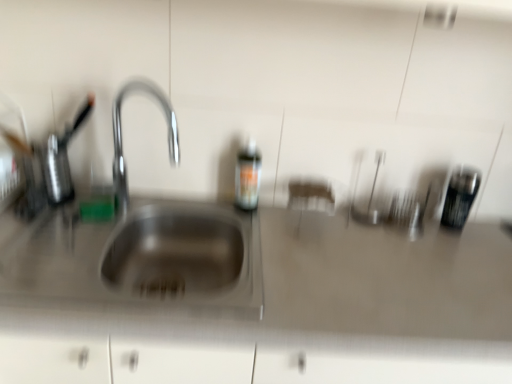
Question: Is satin steel sink at center wider than translucent plastic bottle at center?

Choices:
 (A) yes
 (B) no

Answer: (A)

Question: Is satin steel sink at center touching translucent plastic bottle at center?

Choices:
 (A) no
 (B) yes

Answer: (A)

Question: Is satin steel sink at center positioned behind translucent plastic bottle at center?

Choices:
 (A) yes
 (B) no

Answer: (B)

Question: Can you confirm if satin steel sink at center is positioned to the right of translucent plastic bottle at center?

Choices:
 (A) yes
 (B) no

Answer: (A)

Question: From a real-world perspective, is satin steel sink at center beneath translucent plastic bottle at center?

Choices:
 (A) yes
 (B) no

Answer: (A)

Question: Does satin steel sink at center have a lesser width compared to translucent plastic bottle at center?

Choices:
 (A) yes
 (B) no

Answer: (B)

Question: From a real-world perspective, is satin steel sink at center physically below stainless steel sink at left?

Choices:
 (A) yes
 (B) no

Answer: (A)

Question: From a real-world perspective, is satin steel sink at center located higher than stainless steel sink at left?

Choices:
 (A) no
 (B) yes

Answer: (A)

Question: From the image's perspective, is satin steel sink at center on stainless steel sink at left?

Choices:
 (A) yes
 (B) no

Answer: (B)

Question: Could you tell me if satin steel sink at center is facing stainless steel sink at left?

Choices:
 (A) no
 (B) yes

Answer: (A)

Question: Considering the relative positions of satin steel sink at center and stainless steel sink at left in the image provided, is satin steel sink at center to the right of stainless steel sink at left from the viewer's perspective?

Choices:
 (A) no
 (B) yes

Answer: (B)

Question: Is stainless steel sink at left at the back of satin steel sink at center?

Choices:
 (A) no
 (B) yes

Answer: (A)

Question: Considering the relative sizes of metallic black canister at right and translucent plastic bottle at center in the image provided, is metallic black canister at right shorter than translucent plastic bottle at center?

Choices:
 (A) no
 (B) yes

Answer: (B)